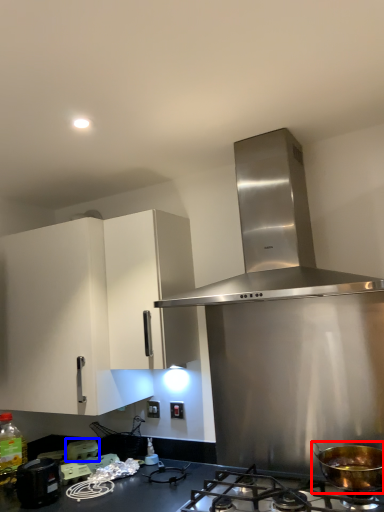
Question: Which of the following is the farthest to the observer, kitchen appliance (highlighted by a red box) or appliance (highlighted by a blue box)?

Choices:
 (A) kitchen appliance
 (B) appliance

Answer: (B)